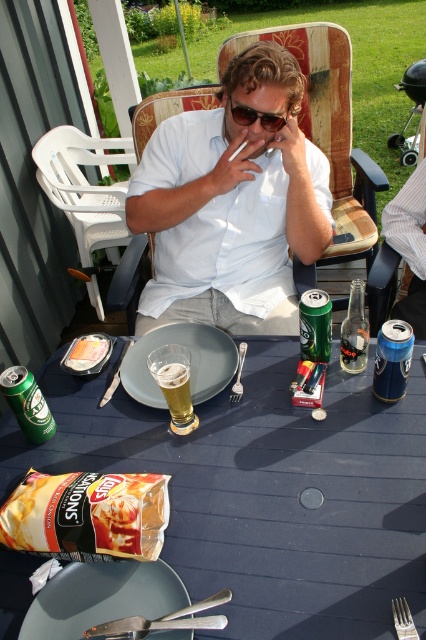
Question: Among these objects, which one is farthest from the camera?

Choices:
 (A) black plastic sunglasses at center
 (B) matte brown chips at lower left
 (C) blue wood table at center

Answer: (A)

Question: Which point appears closest to the camera in this image?

Choices:
 (A) (207, 467)
 (B) (184, 272)

Answer: (A)

Question: Which of the following is the closest to the observer?

Choices:
 (A) (209, 294)
 (B) (29, 492)
 (C) (302, 576)

Answer: (C)

Question: Can you confirm if blue wood table at center is positioned to the left of white cotton shirt at center?

Choices:
 (A) no
 (B) yes

Answer: (B)

Question: Can you confirm if matte brown chips at lower left is bigger than black plastic sunglasses at center?

Choices:
 (A) yes
 (B) no

Answer: (A)

Question: Where is blue wood table at center located in relation to black plastic sunglasses at center in the image?

Choices:
 (A) right
 (B) left

Answer: (B)